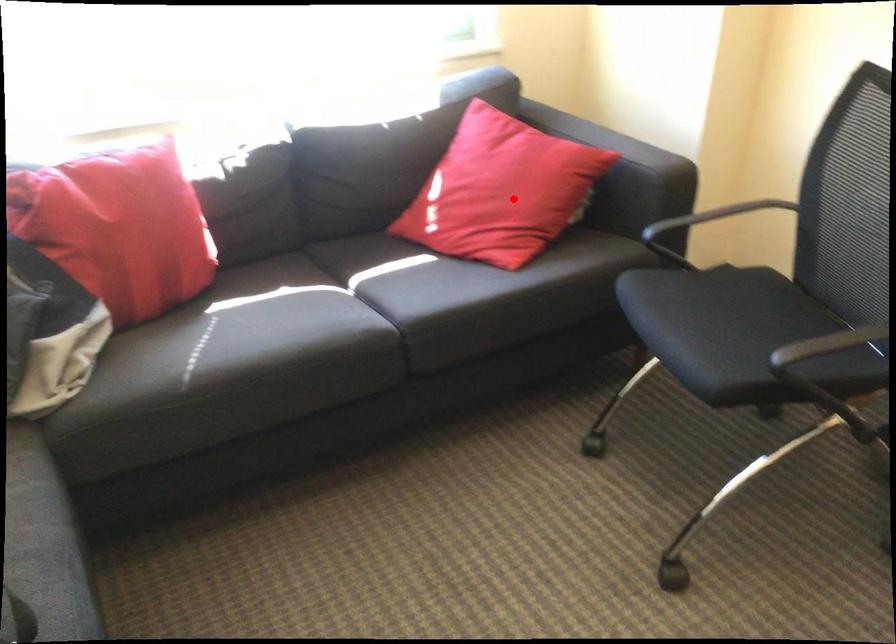
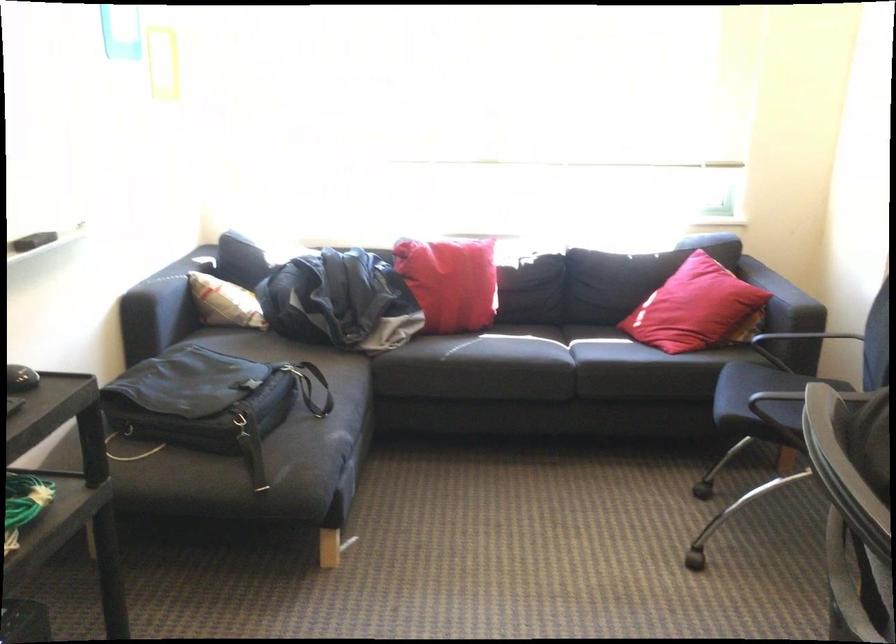
Question: I am providing you with two images of the same scene from different viewpoints. In image1, a red point is highlighted. Considering the same 3D point in image2, which of the following is correct?

Choices:
 (A) It is closer
 (B) It is farther

Answer: (B)